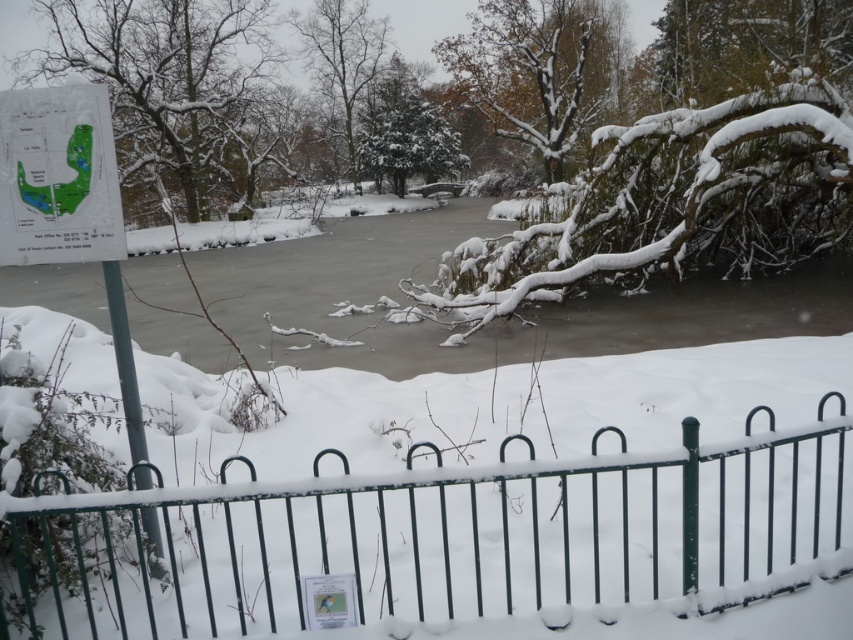
From the picture: Is frozen ice at center taller than snow-covered tree at upper center?

No, frozen ice at center is not taller than snow-covered tree at upper center.

This screenshot has width=853, height=640. What do you see at coordinates (492, 323) in the screenshot?
I see `frozen ice at center` at bounding box center [492, 323].

Where is `frozen ice at center`? This screenshot has width=853, height=640. frozen ice at center is located at coordinates (492, 323).

Is green paper map at upper left behind green textured tree at upper center?

That is False.

Does green paper map at upper left have a lesser height compared to green textured tree at upper center?

No.

Find the location of a particular element. The image size is (853, 640). green paper map at upper left is located at coordinates (57, 177).

Where is `green paper map at upper left`? This screenshot has height=640, width=853. green paper map at upper left is located at coordinates (57, 177).

Who is positioned more to the left, snow-covered metal fence at lower center or snow-covered tree at upper center?

Positioned to the left is snow-covered metal fence at lower center.

Is point (276, 497) positioned behind point (595, 100)?

No, (276, 497) is in front of (595, 100).

Identify the location of snow-covered metal fence at lower center. The width and height of the screenshot is (853, 640). (434, 536).